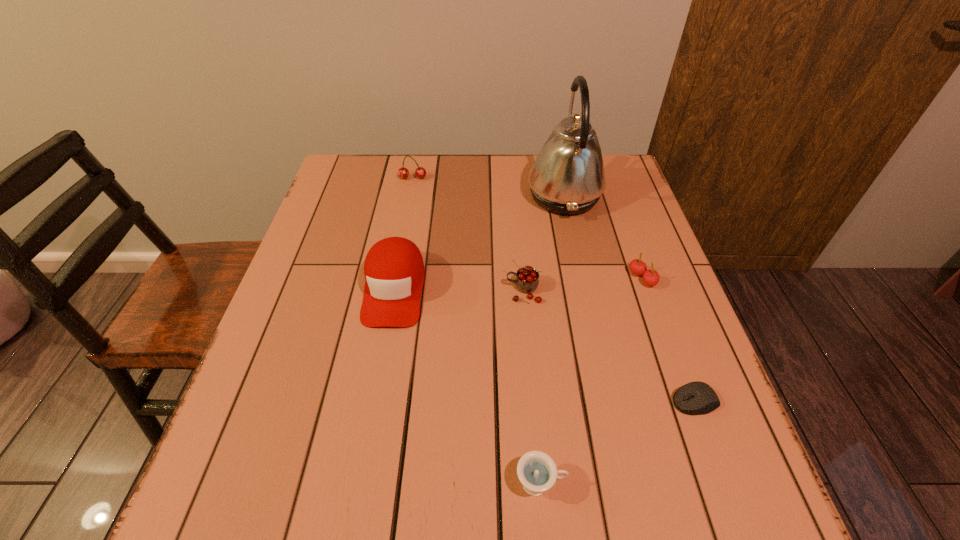
Find the location of `cherry that is at the far edge`. cherry that is at the far edge is located at coordinates (420, 172).

Where is `object that is at the near edge`? The height and width of the screenshot is (540, 960). object that is at the near edge is located at coordinates (537, 471).

Locate an element on the screen. kettle that is at the right edge is located at coordinates (567, 177).

I want to click on cherry present at the right edge, so click(651, 277).

Find the location of a particular element. This screenshot has height=540, width=960. computer equipment that is at the right edge is located at coordinates (695, 398).

Image resolution: width=960 pixels, height=540 pixels. In order to click on object at the far right corner in this screenshot , I will do `click(567, 177)`.

In the image, there is a desktop. What are the coordinates of `free region at the far edge` in the screenshot? It's located at (433, 173).

In the image, there is a desktop. At what (x,y) coordinates should I click in order to perform the action: click on free space at the left edge. Please return your answer as a coordinate pair (x, y). The image size is (960, 540). Looking at the image, I should click on (335, 212).

Locate an element on the screen. The width and height of the screenshot is (960, 540). vacant space at the right edge of the desktop is located at coordinates (635, 232).

This screenshot has width=960, height=540. In the image, there is a desktop. Find the location of `free space at the far left corner`. free space at the far left corner is located at coordinates (340, 161).